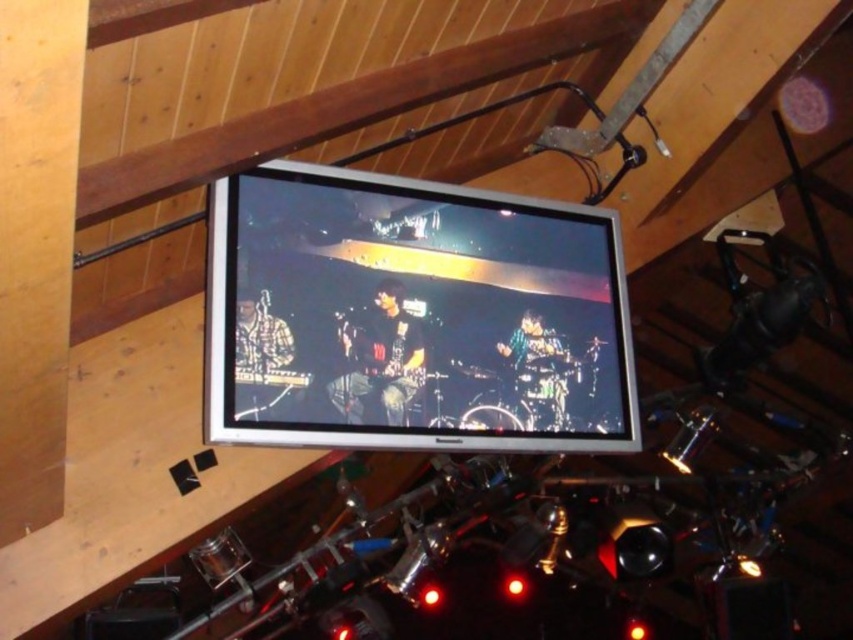
You are standing in a room with a wooden panelled ceiling and you see a point marked at coordinates (x=412, y=316). What object is located at that point?

The point at coordinates (x=412, y=316) indicates the location of the matte silver tv at upper center.

You are a technician who needs to adjust the distance between the matte silver tv at upper center and the shiny black guitar at center to exactly 8 inches. Currently, the distance is 6.03 inches. What should you do?

The matte silver tv at upper center is currently 6.03 inches from the shiny black guitar at center. To reach the desired 8 inches, you should move the shiny black guitar at center away from the matte silver tv at upper center by approximately 1.97 inches.

In the scene shown: You are a musician who wants to grab the shiny black guitar at center and the shiny metallic drum set at center quickly. Which one is easier to reach from your current position on the floor?

The shiny black guitar at center is positioned over the shiny metallic drum set at center, so the shiny metallic drum set at center is lower and easier to reach from the floor.